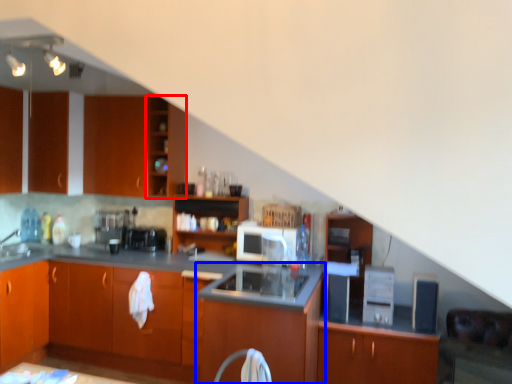
Question: Among these objects, which one is nearest to the camera, shelf (highlighted by a red box) or cabinetry (highlighted by a blue box)?

Choices:
 (A) shelf
 (B) cabinetry

Answer: (B)